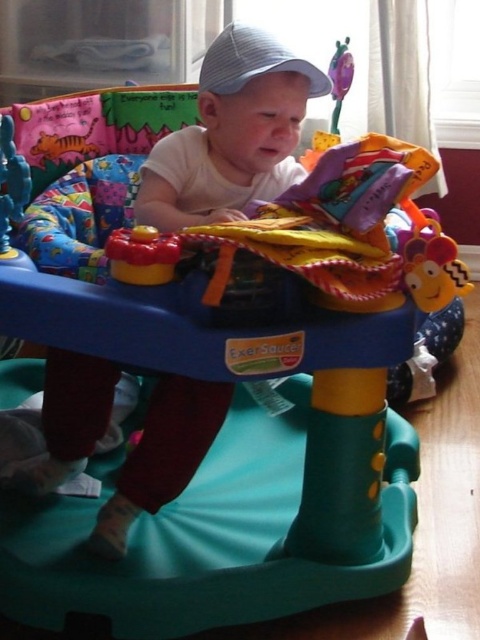
Can you confirm if white cotton baby at center is positioned above rubberized plastic toy at center?

No, white cotton baby at center is not above rubberized plastic toy at center.

Is point (104, 208) in front of point (12, 138)?

No.

Locate an element on the screen. white cotton baby at center is located at coordinates (189, 157).

Is white fabric hat at upper center smaller than rubberized plastic toy at center?

No.

Is point (277, 51) closer to camera compared to point (16, 204)?

No, (277, 51) is further to viewer.

Is point (309, 72) positioned before point (8, 204)?

No, it is not.

Identify the location of white fabric hat at upper center. Image resolution: width=480 pixels, height=640 pixels. (252, 61).

What do you see at coordinates (189, 157) in the screenshot? The height and width of the screenshot is (640, 480). I see `white cotton baby at center` at bounding box center [189, 157].

Is the position of white cotton baby at center less distant than that of rubberized yellow and red toy at center?

No, it is behind rubberized yellow and red toy at center.

Measure the distance between white cotton baby at center and camera.

white cotton baby at center is 97.70 centimeters away from camera.

Image resolution: width=480 pixels, height=640 pixels. What are the coordinates of `white cotton baby at center` in the screenshot? It's located at tap(189, 157).